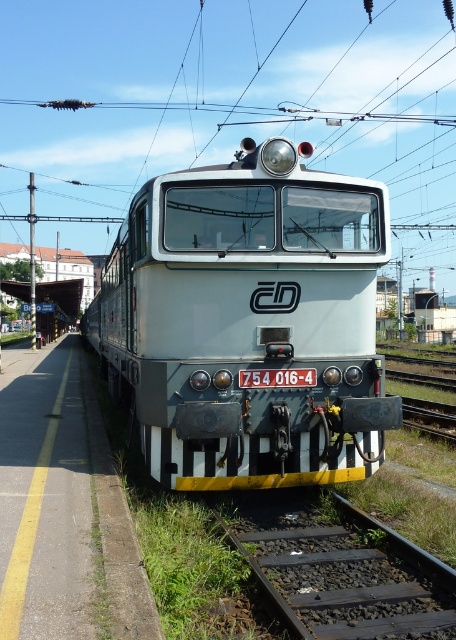
Question: Is black metal train track at lower right smaller than black metal train track at lower center?

Choices:
 (A) no
 (B) yes

Answer: (B)

Question: Observing the image, what is the correct spatial positioning of white glossy train at center in reference to black metal train track at lower center?

Choices:
 (A) right
 (B) left

Answer: (B)

Question: Does white glossy train at center appear over black metal train track at lower right?

Choices:
 (A) yes
 (B) no

Answer: (A)

Question: Which object appears closest to the camera in this image?

Choices:
 (A) black metal train track at lower right
 (B) black metal train track at lower center

Answer: (A)

Question: Which point is farther from the camera taking this photo?

Choices:
 (A) click(x=315, y=440)
 (B) click(x=449, y=412)

Answer: (B)

Question: Which point appears farthest from the camera in this image?

Choices:
 (A) [259, 540]
 (B) [418, 417]
 (C) [336, 403]

Answer: (B)